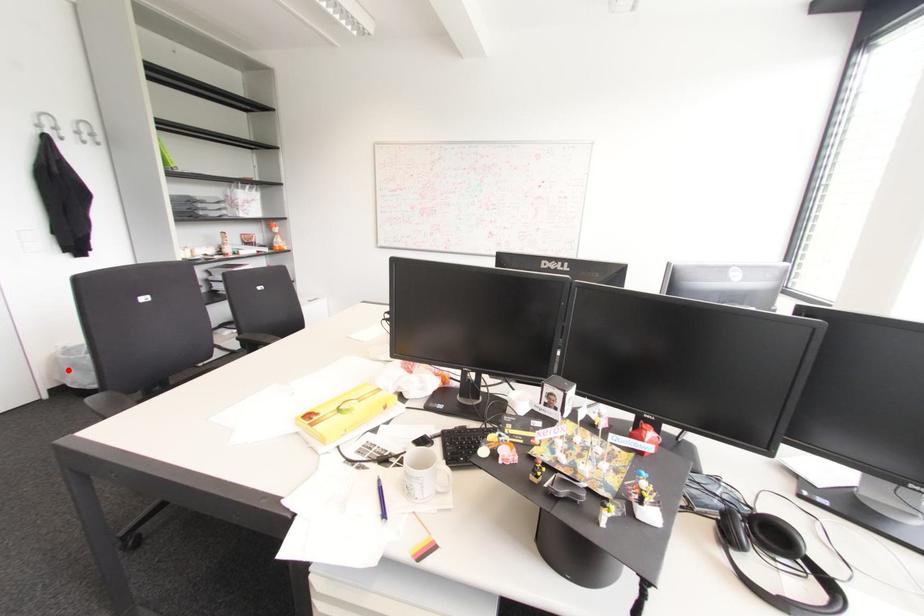
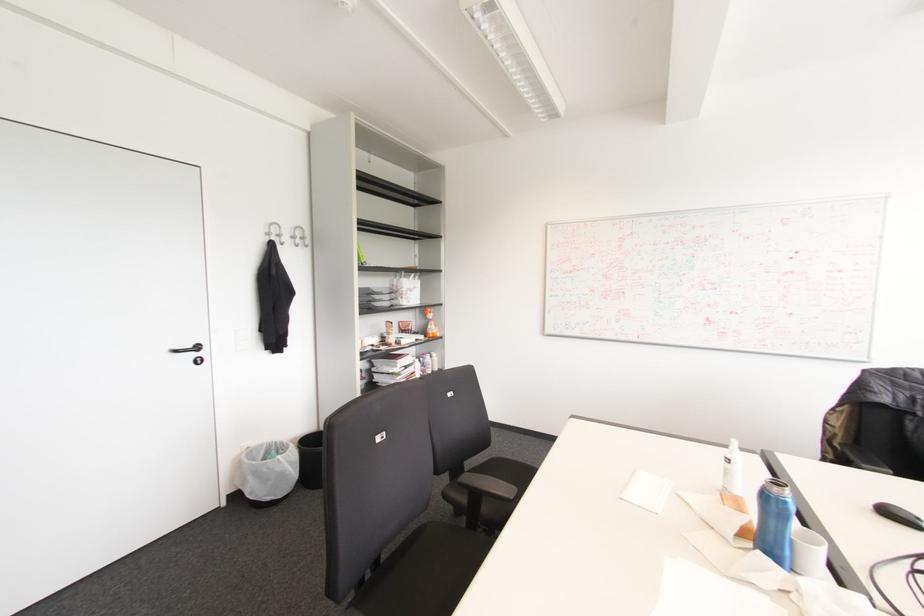
Find the pixel in the second image that matches the highlighted location in the first image.

(249, 477)